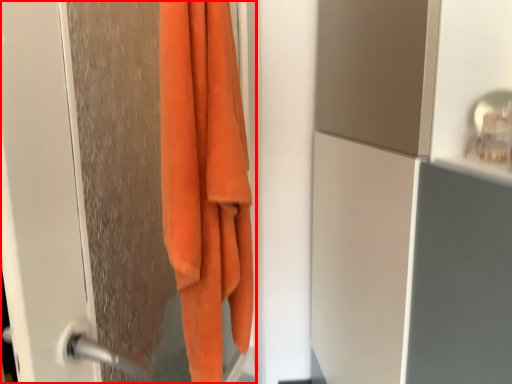
Question: Considering the relative positions of screen door (annotated by the red box) and towel in the image provided, where is screen door (annotated by the red box) located with respect to the staircase?

Choices:
 (A) right
 (B) left

Answer: (B)